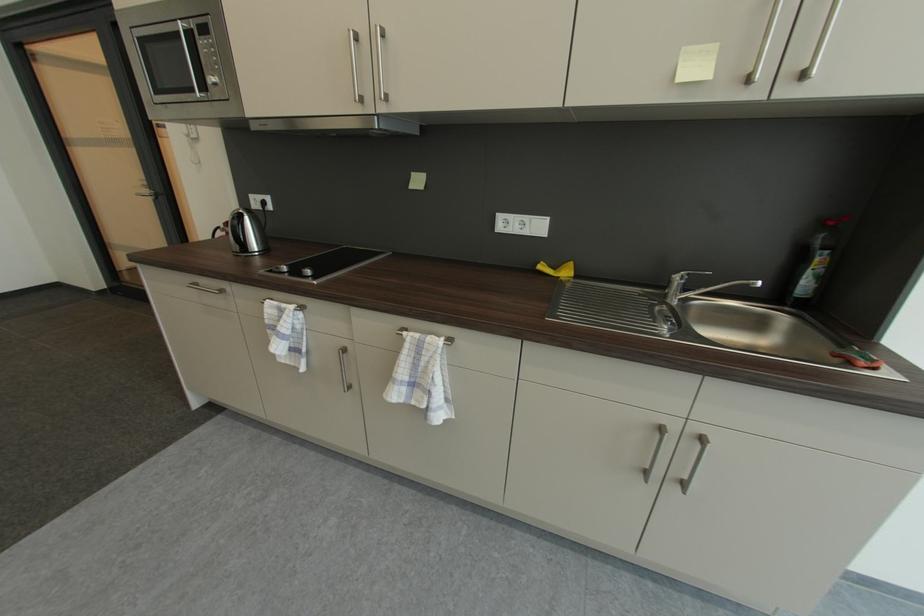
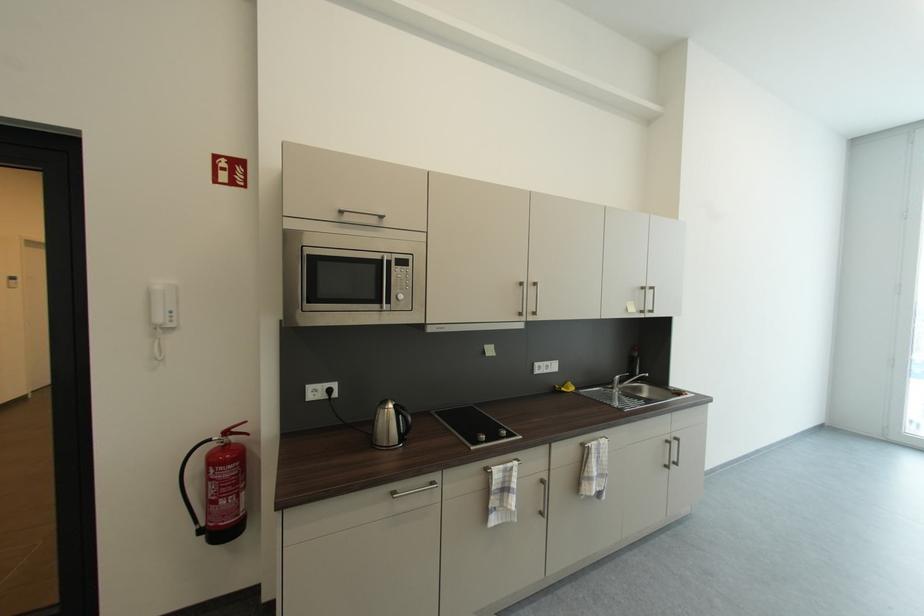
The point at (679, 431) is marked in the first image. Where is the corresponding point in the second image?

(675, 440)